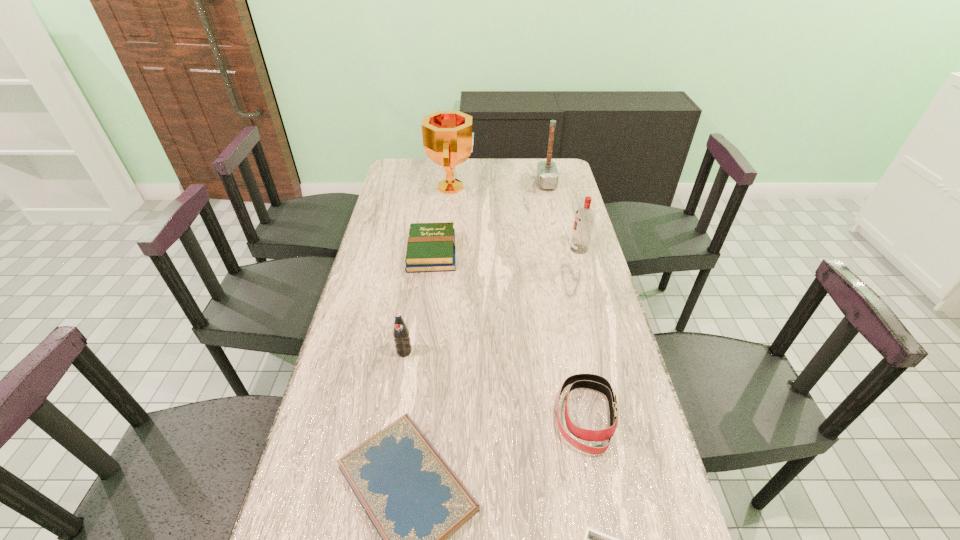
At what (x,y) coordinates should I click in order to perform the action: click on free space between the award and the dog collar. Please return your answer as a coordinate pair (x, y). The width and height of the screenshot is (960, 540). Looking at the image, I should click on (519, 301).

What are the coordinates of `empty space between the hammer and the dog collar` in the screenshot? It's located at (566, 300).

At what (x,y) coordinates should I click in order to perform the action: click on unoccupied area between the award and the dog collar. Please return your answer as a coordinate pair (x, y). Looking at the image, I should click on (519, 301).

Locate which object ranks fourth in proximity to the vodka. Please provide its 2D coordinates. Your answer should be formatted as a tuple, i.e. [(x, y)], where the tuple contains the x and y coordinates of a point satisfying the conditions above.

[(590, 381)]

This screenshot has width=960, height=540. In order to click on object that stands as the fifth closest to the dog collar in this screenshot , I will do `click(584, 217)`.